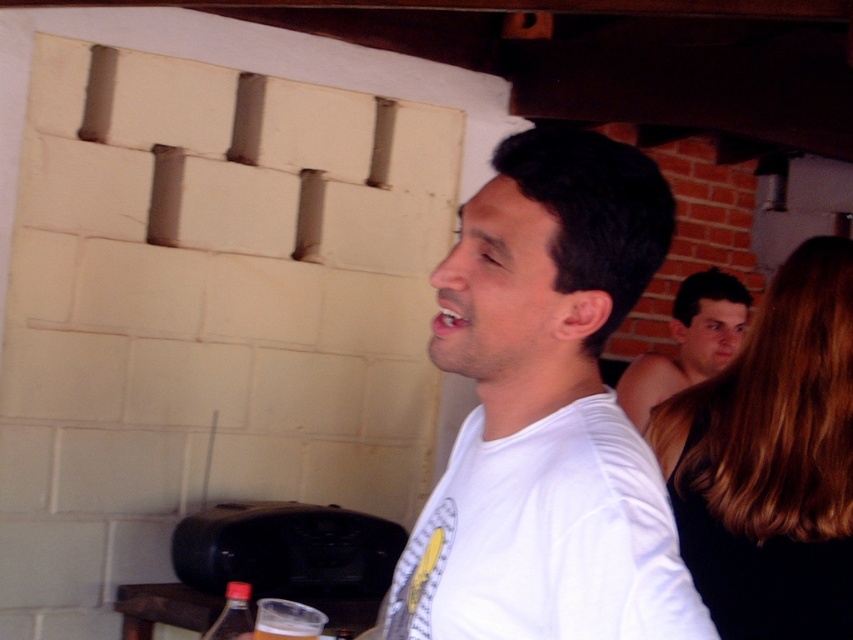
Question: Is white matte shirt at center wider than translucent plastic cup at lower center?

Choices:
 (A) no
 (B) yes

Answer: (B)

Question: Estimate the real-world distances between objects in this image. Which object is farther from the smooth black dress at right?

Choices:
 (A) white matte shirt at center
 (B) smooth skin face at upper right
 (C) translucent plastic cup at lower center

Answer: (B)

Question: Among these points, which one is nearest to the camera?

Choices:
 (A) (627, 416)
 (B) (839, 388)
 (C) (515, 202)

Answer: (C)

Question: Is the position of white matte shirt at center less distant than that of translucent plastic cup at lower center?

Choices:
 (A) no
 (B) yes

Answer: (B)

Question: Is smooth black dress at right below smooth skin face at upper right?

Choices:
 (A) yes
 (B) no

Answer: (A)

Question: Which point is closer to the camera?

Choices:
 (A) (701, 340)
 (B) (321, 620)
 (C) (730, 561)
 (D) (543, 360)

Answer: (D)